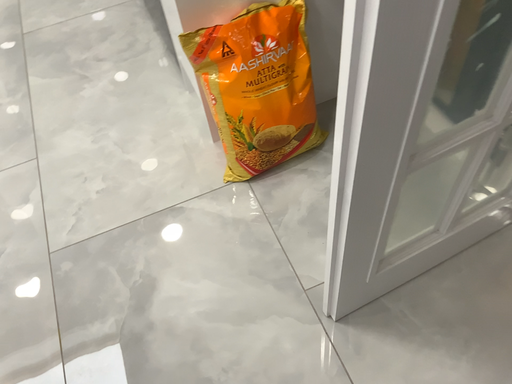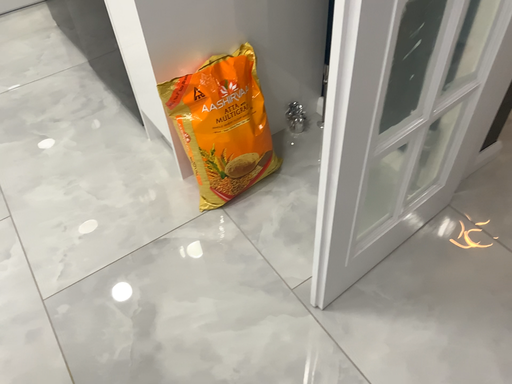
Question: Which way did the camera rotate in the video?

Choices:
 (A) rotated left
 (B) rotated right

Answer: (B)